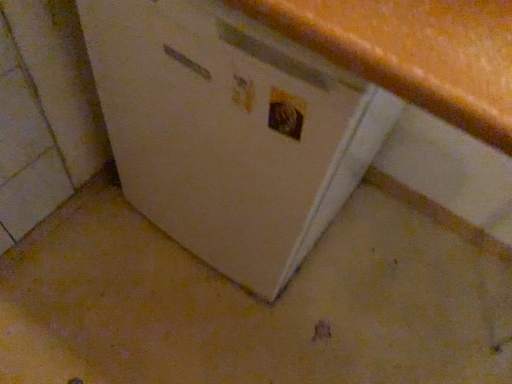
I want to click on white matte cabinet at lower center, so click(220, 128).

Measure the distance between point (167, 151) and camera.

A distance of 34.69 inches exists between point (167, 151) and camera.

Describe the element at coordinates (220, 128) in the screenshot. This screenshot has width=512, height=384. I see `white matte cabinet at lower center` at that location.

Locate an element on the screen. The image size is (512, 384). white matte cabinet at lower center is located at coordinates (220, 128).